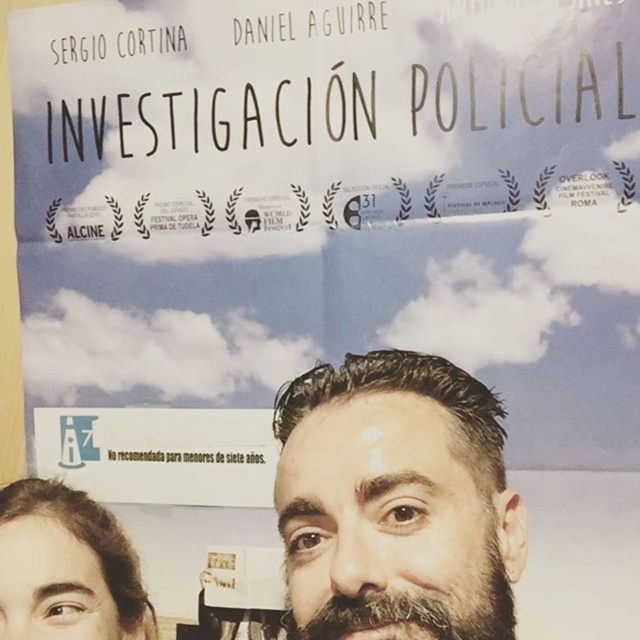
Who is lower down, brown hair at center or bearded man at lower left?

bearded man at lower left is lower down.

Which is above, brown hair at center or bearded man at lower left?

brown hair at center is above.

Who is more distant from viewer, (413, 356) or (74, 579)?

The point (74, 579) is behind.

Where is `brown hair at center`? This screenshot has width=640, height=640. brown hair at center is located at coordinates (396, 502).

From the picture: Can you confirm if brown hair at center is taller than dark brown fuzzy beard at center?

→ Yes.

Is brown hair at center below dark brown fuzzy beard at center?

Incorrect, brown hair at center is not positioned below dark brown fuzzy beard at center.

The width and height of the screenshot is (640, 640). What do you see at coordinates (396, 502) in the screenshot? I see `brown hair at center` at bounding box center [396, 502].

Where is `brown hair at center`? brown hair at center is located at coordinates (396, 502).

From the picture: Is bearded man at lower left positioned in front of dark brown fuzzy beard at center?

No, it is not.

Which of these two, bearded man at lower left or dark brown fuzzy beard at center, stands taller?

bearded man at lower left is taller.

Which is behind, point (84, 536) or point (484, 627)?

The point (84, 536) is behind.

I want to click on bearded man at lower left, so click(x=67, y=568).